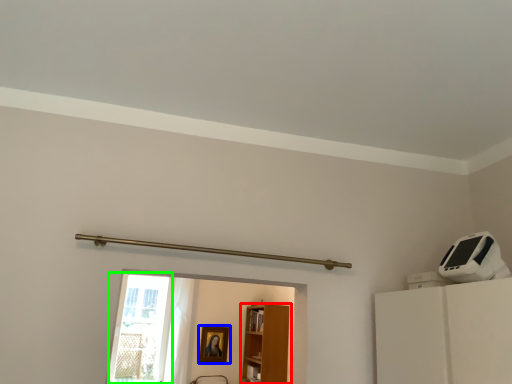
Question: Estimate the real-world distances between objects in this image. Which object is closer to furniture (highlighted by a red box), picture frame (highlighted by a blue box) or glass door (highlighted by a green box)?

Choices:
 (A) picture frame
 (B) glass door

Answer: (A)